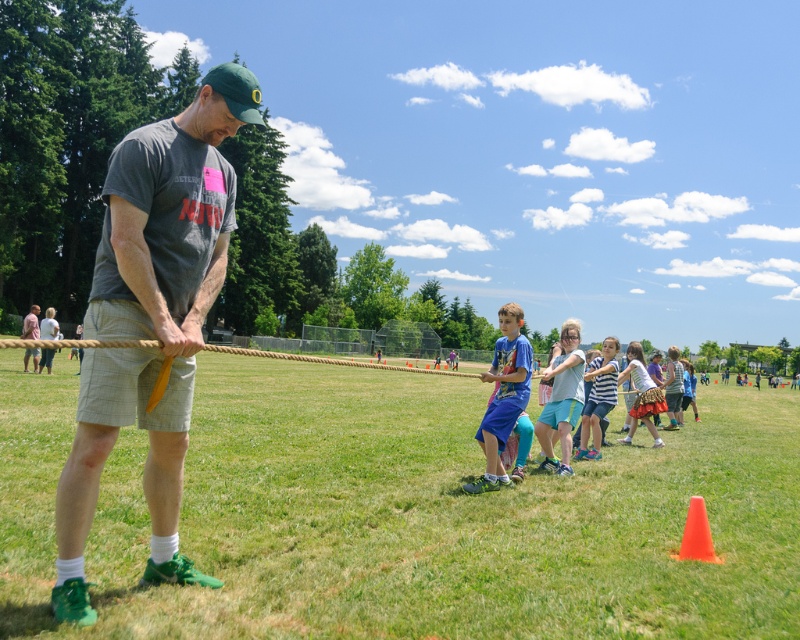
You are a photographer at the event and need to ensure both the light blue denim shorts at center and the striped cotton shirt at center are clearly visible in your photo. Given their sizes, which one might require you to adjust your camera focus more carefully to avoid blurring?

The striped cotton shirt at center is smaller in size than the light blue denim shorts at center, so it might require more careful focus adjustment to avoid blurring.